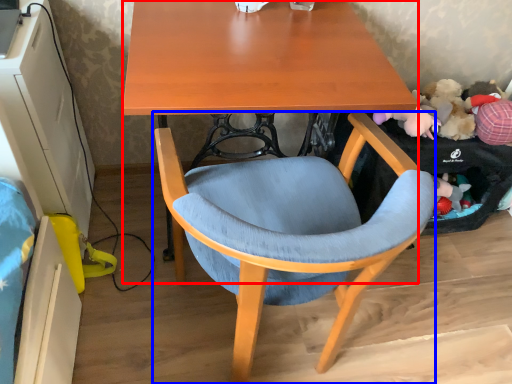
Question: Which point is closer to the camera, desk (highlighted by a red box) or chair (highlighted by a blue box)?

Choices:
 (A) desk
 (B) chair

Answer: (B)